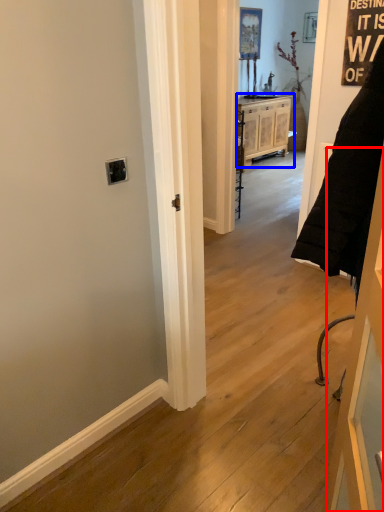
Question: Among these objects, which one is nearest to the camera, door (highlighted by a red box) or cabinetry (highlighted by a blue box)?

Choices:
 (A) door
 (B) cabinetry

Answer: (A)